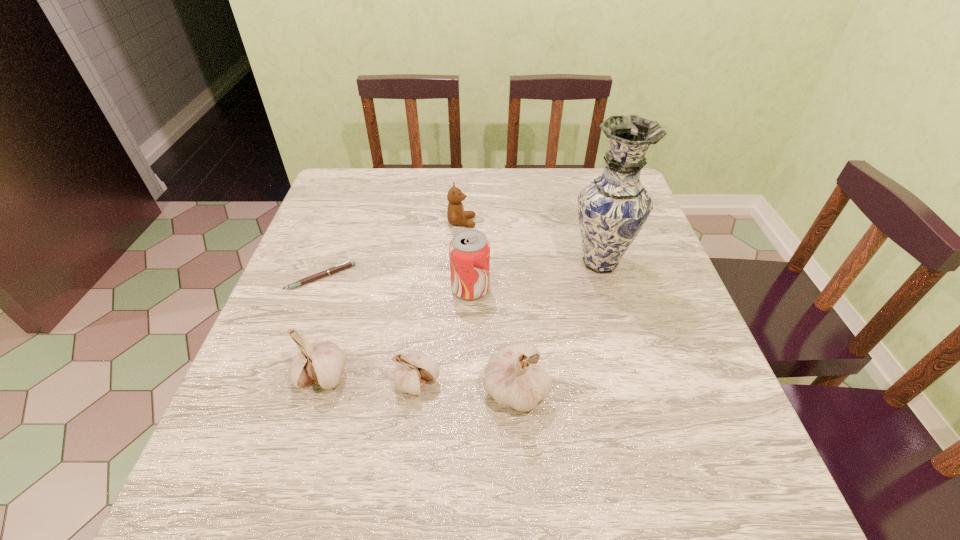
At what (x,y) coordinates should I click in order to perform the action: click on vacant space situated 0.120m on the right of the shortest garlic. Please return your answer as a coordinate pair (x, y). Looking at the image, I should click on (503, 382).

At what (x,y) coordinates should I click in order to perform the action: click on free location located 0.370m on the back of the rightmost garlic. Please return your answer as a coordinate pair (x, y). Looking at the image, I should click on (506, 242).

What are the coordinates of `vacant space located 0.360m on the front-facing side of the farthest object` in the screenshot? It's located at (608, 222).

The height and width of the screenshot is (540, 960). I want to click on free spot located on the left of the rightmost object, so click(422, 262).

I want to click on blank space located at the nib of the shortest object, so click(273, 407).

Where is `free space located 0.160m on the left of the soda can`? The image size is (960, 540). free space located 0.160m on the left of the soda can is located at coordinates pyautogui.click(x=382, y=288).

Identify the location of object located in the far edge section of the desktop. (456, 215).

The image size is (960, 540). What are the coordinates of `garlic that is positioned at the left edge` in the screenshot? It's located at (321, 363).

Where is `pen that is at the left edge`? pen that is at the left edge is located at coordinates (347, 264).

The width and height of the screenshot is (960, 540). What are the coordinates of `object that is positioned at the right edge` in the screenshot? It's located at (612, 209).